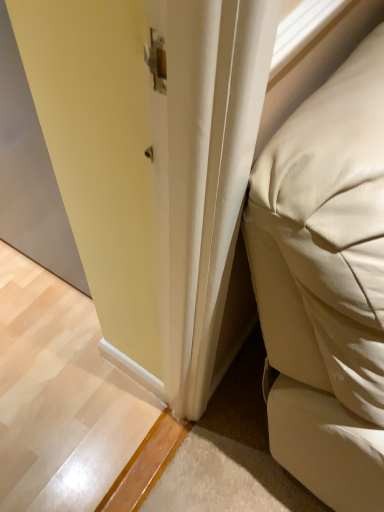
What do you see at coordinates (30, 174) in the screenshot? I see `matte gray screen door at left` at bounding box center [30, 174].

The width and height of the screenshot is (384, 512). In order to click on matte gray screen door at left in this screenshot , I will do `click(30, 174)`.

Describe the element at coordinates (326, 283) in the screenshot. I see `beige leather bed at right` at that location.

Identify the location of beige leather bed at right. Image resolution: width=384 pixels, height=512 pixels. (x=326, y=283).

The width and height of the screenshot is (384, 512). Find the location of `matte gray screen door at left`. matte gray screen door at left is located at coordinates (30, 174).

Can you confirm if matte gray screen door at left is positioned to the right of beige leather bed at right?

No, matte gray screen door at left is not to the right of beige leather bed at right.

Between matte gray screen door at left and beige leather bed at right, which one is positioned in front?

beige leather bed at right is closer to the camera.

Considering the points (47, 179) and (268, 341), which point is in front, point (47, 179) or point (268, 341)?

The point (268, 341) is closer to the camera.

From the image's perspective, is matte gray screen door at left located above or below beige leather bed at right?

From the image's perspective, matte gray screen door at left appears above beige leather bed at right.

Consider the image. From a real-world perspective, between matte gray screen door at left and beige leather bed at right, who is vertically lower?

matte gray screen door at left is physically lower.

Considering the sizes of objects matte gray screen door at left and beige leather bed at right in the image provided, who is wider, matte gray screen door at left or beige leather bed at right?

With larger width is beige leather bed at right.

In terms of height, does matte gray screen door at left look taller or shorter compared to beige leather bed at right?

Clearly, matte gray screen door at left is shorter compared to beige leather bed at right.

Is matte gray screen door at left bigger than beige leather bed at right?

Incorrect, matte gray screen door at left is not larger than beige leather bed at right.

Is matte gray screen door at left inside or outside of beige leather bed at right?

matte gray screen door at left exists outside the volume of beige leather bed at right.

Are matte gray screen door at left and beige leather bed at right located far from each other?

No, matte gray screen door at left is not far away from beige leather bed at right.

Is matte gray screen door at left facing towards beige leather bed at right?

No.

How many degrees apart are the facing directions of matte gray screen door at left and beige leather bed at right?

The facing directions of matte gray screen door at left and beige leather bed at right are 91.4 degrees apart.

Image resolution: width=384 pixels, height=512 pixels. Identify the location of screen door that is above the beige leather bed at right (from the image's perspective). (30, 174).

Which object is positioned more to the right, beige leather bed at right or matte gray screen door at left?

beige leather bed at right.

Considering the positions of objects beige leather bed at right and matte gray screen door at left in the image provided, who is in front, beige leather bed at right or matte gray screen door at left?

beige leather bed at right is more forward.

Is point (317, 179) closer or farther from the camera than point (6, 115)?

Point (317, 179).

From the image's perspective, who appears lower, beige leather bed at right or matte gray screen door at left?

From the image's view, beige leather bed at right is below.

From a real-world perspective, who is located higher, beige leather bed at right or matte gray screen door at left?

From a 3D spatial view, beige leather bed at right is above.

Considering the relative sizes of beige leather bed at right and matte gray screen door at left in the image provided, is beige leather bed at right thinner than matte gray screen door at left?

No.

Is beige leather bed at right shorter than matte gray screen door at left?

No.

Considering the sizes of objects beige leather bed at right and matte gray screen door at left in the image provided, who is bigger, beige leather bed at right or matte gray screen door at left?

Bigger between the two is beige leather bed at right.

Is beige leather bed at right positioned beyond the bounds of matte gray screen door at left?

Yes.

Is beige leather bed at right next to matte gray screen door at left?

No, beige leather bed at right is not next to matte gray screen door at left.

Is beige leather bed at right looking in the opposite direction of matte gray screen door at left?

Yes, matte gray screen door at left is at the back of beige leather bed at right.

Locate an element on the screen. screen door behind the beige leather bed at right is located at coordinates (30, 174).

The image size is (384, 512). Identify the location of screen door on the left of the beige leather bed at right. (30, 174).

Where is `furniture lying below the matte gray screen door at left (from the image's perspective)`? Image resolution: width=384 pixels, height=512 pixels. furniture lying below the matte gray screen door at left (from the image's perspective) is located at coordinates (326, 283).